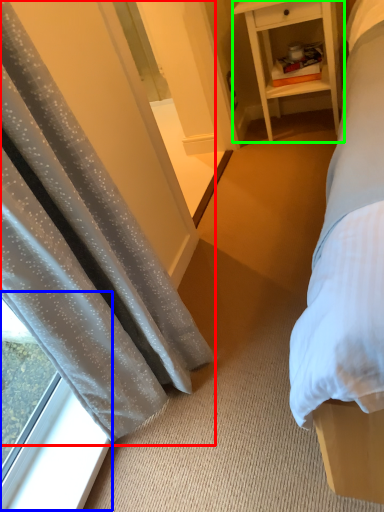
Question: Which object is the closest to the curtain (highlighted by a red box)? Choose among these: window (highlighted by a blue box) or nightstand (highlighted by a green box).

Choices:
 (A) window
 (B) nightstand

Answer: (A)